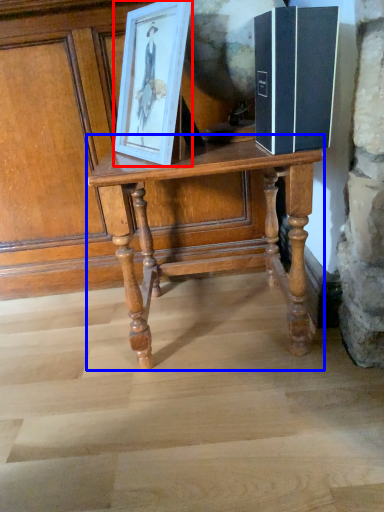
Question: Which object appears farthest to the camera in this image, picture frame (highlighted by a red box) or table (highlighted by a blue box)?

Choices:
 (A) picture frame
 (B) table

Answer: (B)